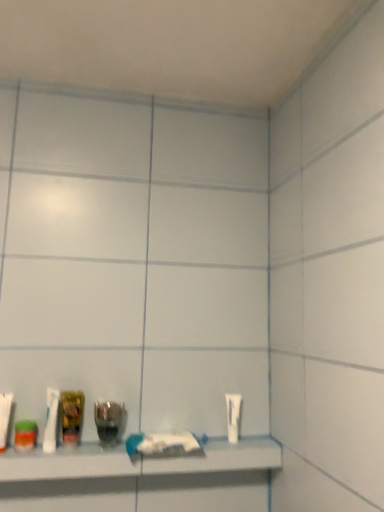
Identify the location of free point above white glossy shelf at lower center (from a real-world perspective). This screenshot has width=384, height=512. (114, 441).